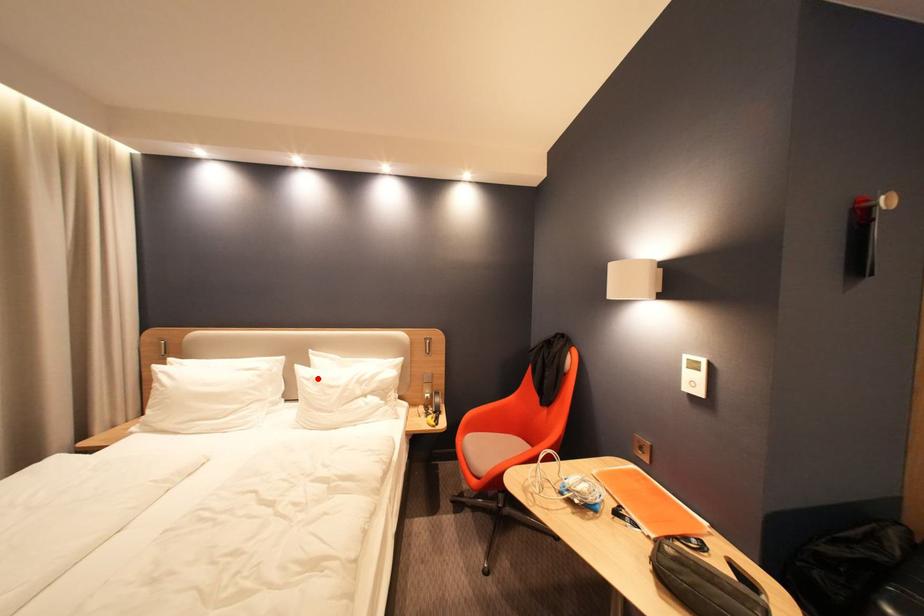
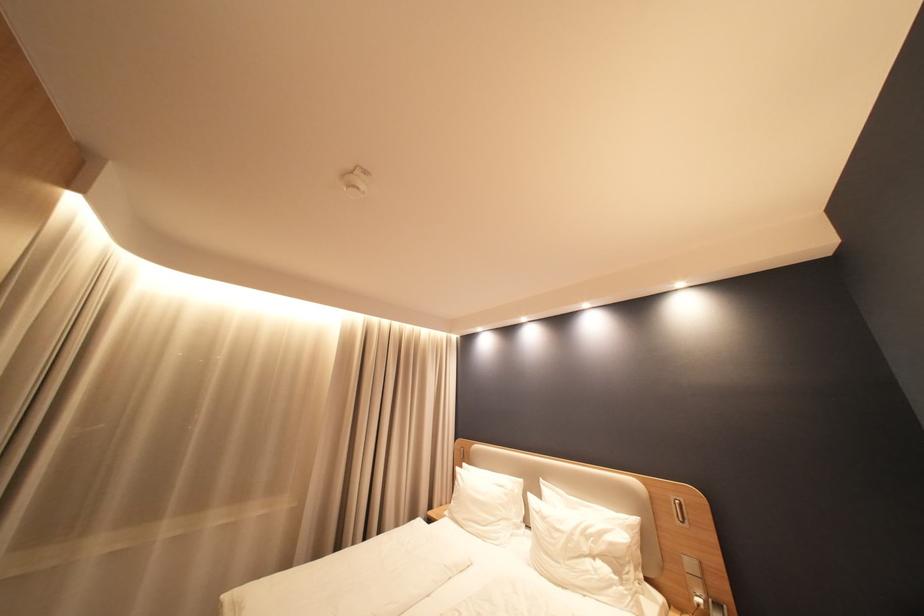
Locate, in the second image, the point that corresponds to the highlighted location in the first image.

(546, 511)